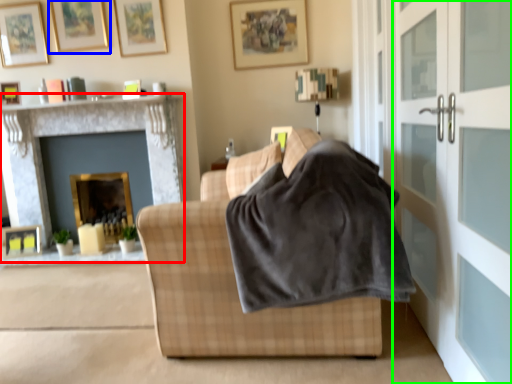
Question: Which is nearer to the fireplace (highlighted by a red box)? picture frame (highlighted by a blue box) or screen door (highlighted by a green box).

Choices:
 (A) picture frame
 (B) screen door

Answer: (A)